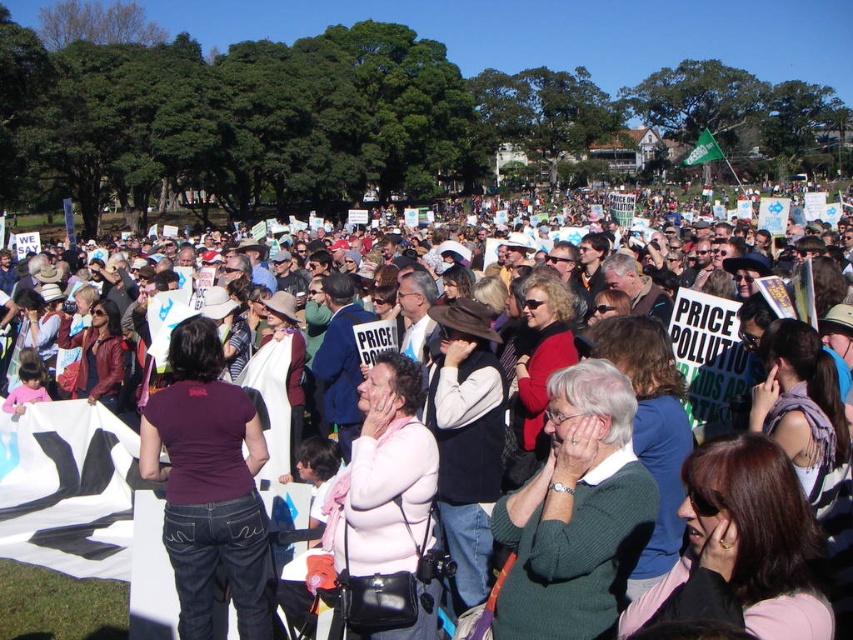
Question: Which point appears farthest from the camera in this image?

Choices:
 (A) (718, 397)
 (B) (567, 387)

Answer: (A)

Question: Is pink fabric at center to the right of green sweater at center from the viewer's perspective?

Choices:
 (A) no
 (B) yes

Answer: (A)

Question: Which point is farther to the camera?

Choices:
 (A) pink fabric at center
 (B) green sweater at center

Answer: (A)

Question: Can you confirm if pink fabric at center is thinner than green sweater at center?

Choices:
 (A) no
 (B) yes

Answer: (A)

Question: Is pink fabric at center thinner than green sweater at center?

Choices:
 (A) no
 (B) yes

Answer: (A)